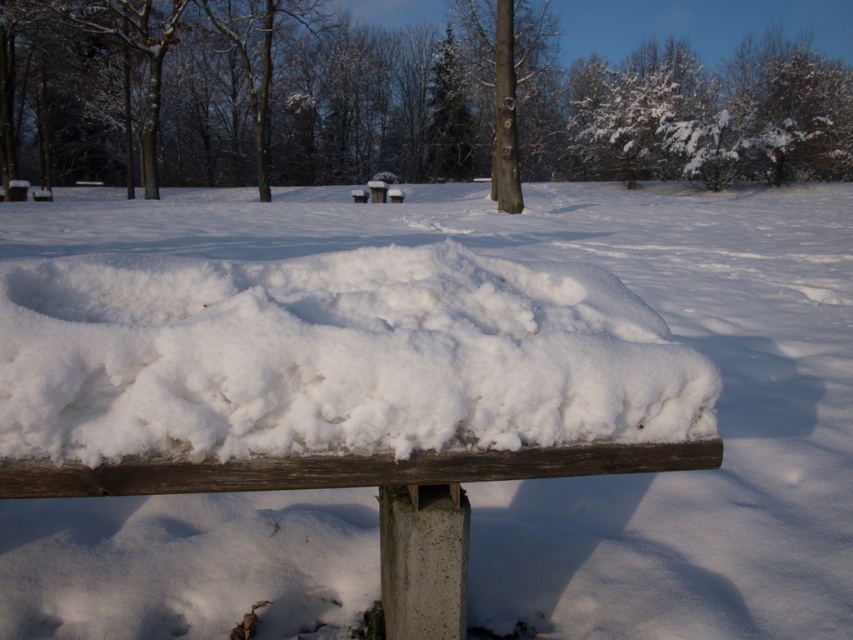
Question: Does snow-covered tree at upper center have a smaller size compared to smooth bark tree at center?

Choices:
 (A) no
 (B) yes

Answer: (A)

Question: Which object is positioned farthest from the snow-covered tree at upper center?

Choices:
 (A) white fluffy snow at center
 (B) smooth bark tree at center

Answer: (A)

Question: Which point is closer to the camera?

Choices:
 (A) smooth bark tree at center
 (B) white fluffy snow at center

Answer: (B)

Question: Can you confirm if snow-covered tree at upper center is smaller than white fluffy snow at center?

Choices:
 (A) no
 (B) yes

Answer: (A)

Question: From the image, what is the correct spatial relationship of snow-covered tree at upper center in relation to smooth bark tree at center?

Choices:
 (A) right
 (B) left

Answer: (B)

Question: Which of the following is the closest to the observer?

Choices:
 (A) coord(474,378)
 (B) coord(22,49)
 (C) coord(497,179)

Answer: (A)